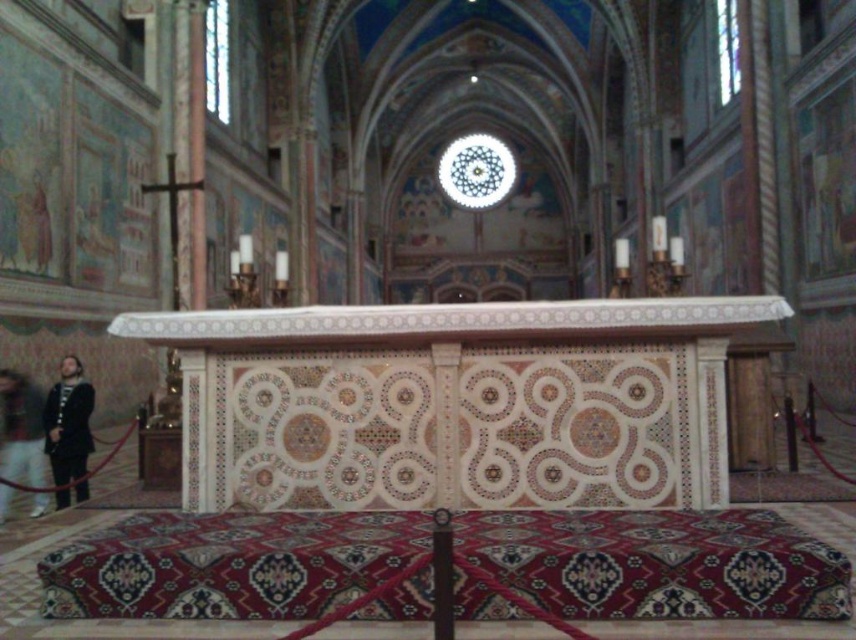
Question: In this image, where is dark brown leather jacket at lower left located relative to light brown leather jacket at lower left?

Choices:
 (A) below
 (B) above

Answer: (A)

Question: Is the position of dark brown leather jacket at lower left less distant than that of light brown leather jacket at lower left?

Choices:
 (A) yes
 (B) no

Answer: (B)

Question: Considering the relative positions of dark brown leather jacket at lower left and light brown leather jacket at lower left in the image provided, where is dark brown leather jacket at lower left located with respect to light brown leather jacket at lower left?

Choices:
 (A) right
 (B) left

Answer: (A)

Question: Which point is closer to the camera?

Choices:
 (A) (73, 458)
 (B) (9, 408)

Answer: (A)

Question: Which point is farther from the camera taking this photo?

Choices:
 (A) (16, 381)
 (B) (75, 449)

Answer: (A)